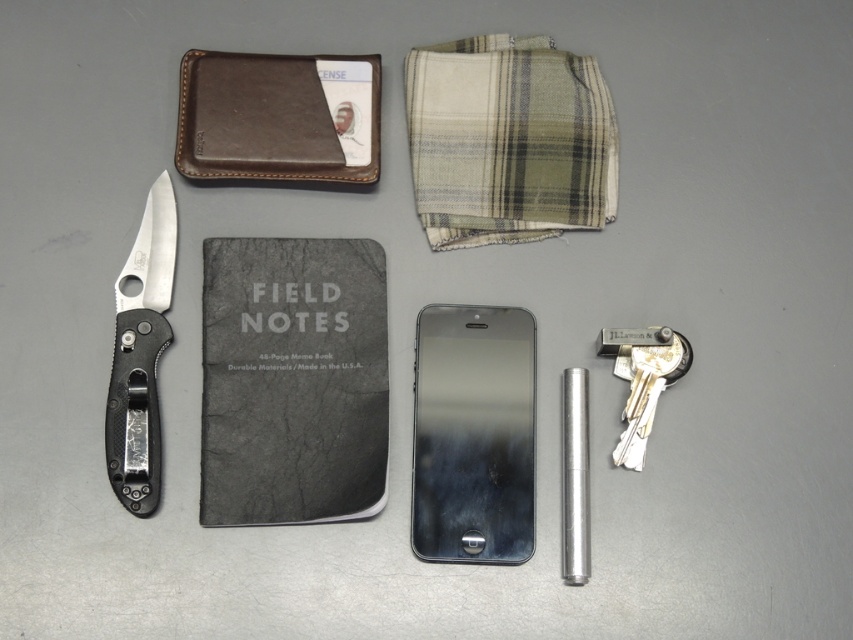
Question: Does metallic silver phone at center have a larger size compared to polished silver blade at left?

Choices:
 (A) yes
 (B) no

Answer: (A)

Question: Considering the real-world distances, which object is closest to the brown leather wallet at upper left?

Choices:
 (A) polished silver blade at left
 (B) silver metallic keys at lower right
 (C) metallic silver phone at center

Answer: (A)

Question: Where is plaid fabric at upper center located in relation to metallic silver phone at center in the image?

Choices:
 (A) left
 (B) right

Answer: (B)

Question: Considering the real-world distances, which object is closest to the metallic silver phone at center?

Choices:
 (A) polished silver blade at left
 (B) brown leather wallet at upper left

Answer: (B)

Question: Is plaid fabric at upper center smaller than brown leather wallet at upper left?

Choices:
 (A) yes
 (B) no

Answer: (B)

Question: Estimate the real-world distances between objects in this image. Which object is closer to the brown leather wallet at upper left?

Choices:
 (A) silver metallic keys at lower right
 (B) polished silver blade at left
 (C) metallic silver phone at center
 (D) plaid fabric at upper center

Answer: (D)